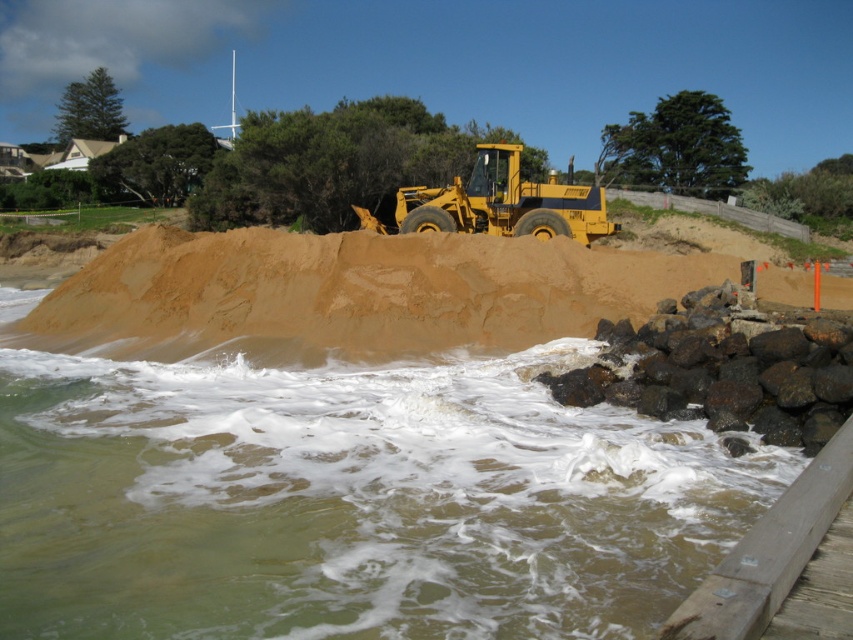
Question: Does brown sandy water at lower left lie behind yellow metallic tractor at center?

Choices:
 (A) yes
 (B) no

Answer: (B)

Question: In this image, where is brown sandy water at lower left located relative to yellow metallic tractor at center?

Choices:
 (A) below
 (B) above

Answer: (A)

Question: Is brown sandy water at lower left bigger than yellow metallic tractor at center?

Choices:
 (A) no
 (B) yes

Answer: (A)

Question: Which point appears farthest from the camera in this image?

Choices:
 (A) (509, 172)
 (B) (27, 611)

Answer: (A)